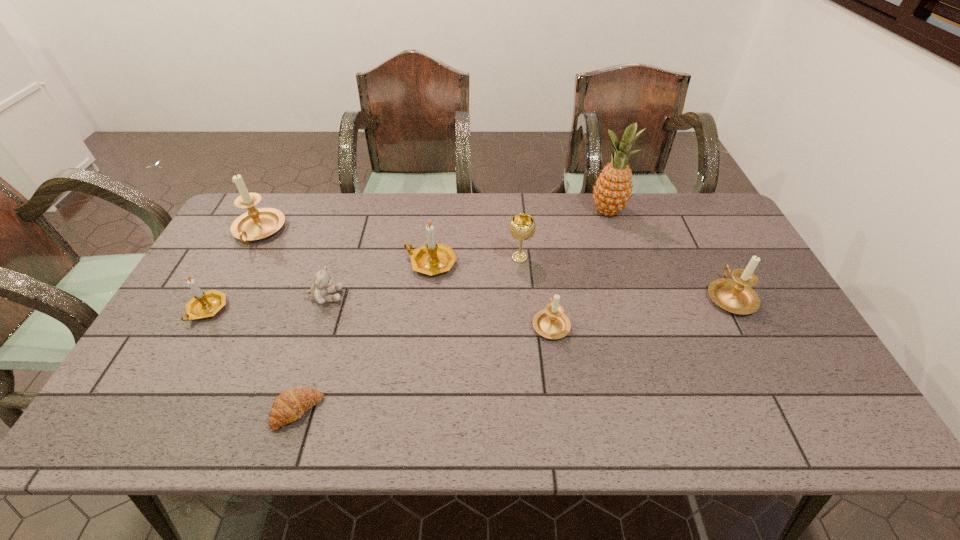
Image resolution: width=960 pixels, height=540 pixels. In order to click on pineapple located at the far edge in this screenshot , I will do `click(612, 190)`.

Where is `candle holder located at the far edge`? This screenshot has height=540, width=960. candle holder located at the far edge is located at coordinates (255, 224).

Where is `object that is at the near edge`? This screenshot has height=540, width=960. object that is at the near edge is located at coordinates (290, 405).

The width and height of the screenshot is (960, 540). Find the location of `object at the right edge`. object at the right edge is located at coordinates (734, 295).

Image resolution: width=960 pixels, height=540 pixels. Find the location of `object present at the far left corner`. object present at the far left corner is located at coordinates (255, 224).

In the image, there is a desktop. At what (x,y) coordinates should I click in order to perform the action: click on vacant space at the far edge. Please return your answer as a coordinate pair (x, y). Looking at the image, I should click on (575, 222).

At what (x,y) coordinates should I click in order to perform the action: click on vacant space at the near edge of the desktop. Please return your answer as a coordinate pair (x, y). Looking at the image, I should click on (248, 411).

The height and width of the screenshot is (540, 960). In the image, there is a desktop. Identify the location of vacant space at the left edge. (129, 392).

In the image, there is a desktop. At what (x,y) coordinates should I click in order to perform the action: click on free region at the right edge. Please return your answer as a coordinate pair (x, y). Image resolution: width=960 pixels, height=540 pixels. Looking at the image, I should click on (800, 400).

This screenshot has height=540, width=960. In order to click on vacant region at the near left corner in this screenshot , I will do `click(105, 429)`.